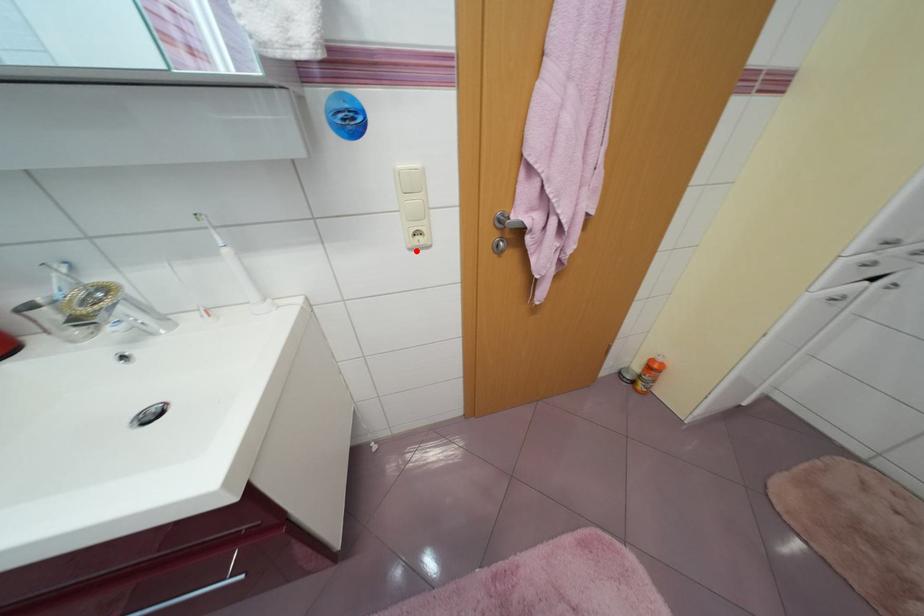
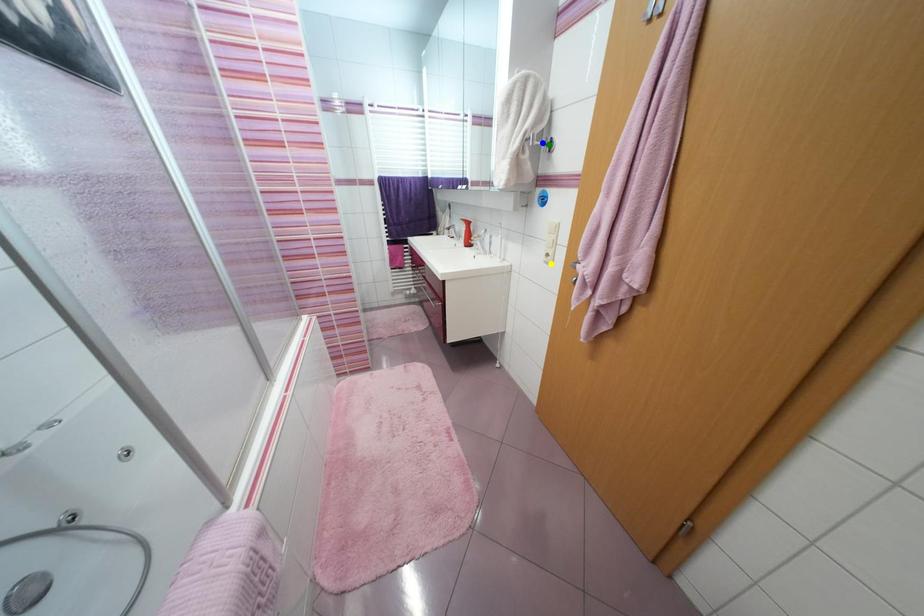
Question: I am providing you with two images of the same scene from different viewpoints. A red point is marked on the first image. You are given multiple points on the second image. In image 2, which mark is for the same physical point as the one in image 1?

Choices:
 (A) yellow point
 (B) blue point
 (C) green point

Answer: (A)